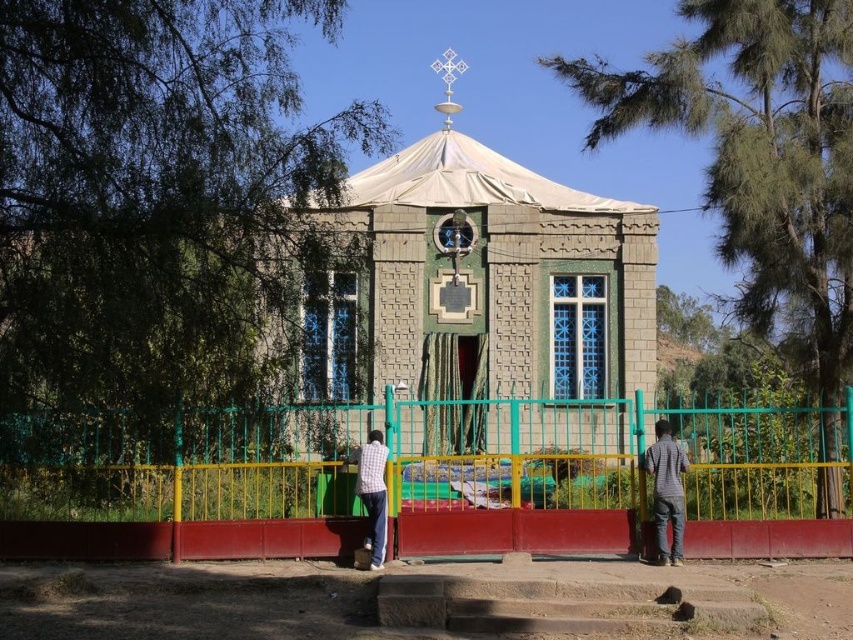
You are a tailor observing two shirts displayed on mannequins in front of the church building. The gray striped shirt at right and the checkered fabric shirt at center. Which shirt is taller?

The gray striped shirt at right is taller than the checkered fabric shirt at center.